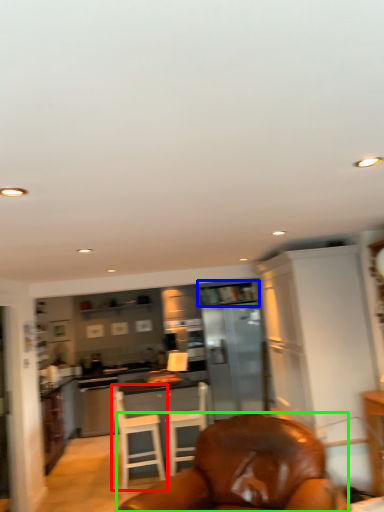
Question: Which object is the closest to the chair (highlighted by a red box)? Choose among these: shelf (highlighted by a blue box) or chair (highlighted by a green box).

Choices:
 (A) shelf
 (B) chair

Answer: (A)